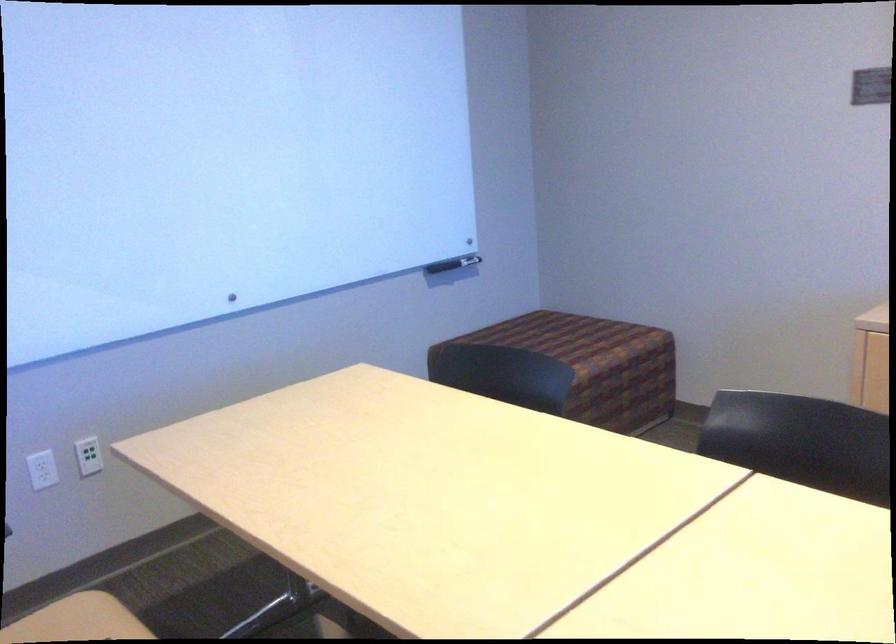
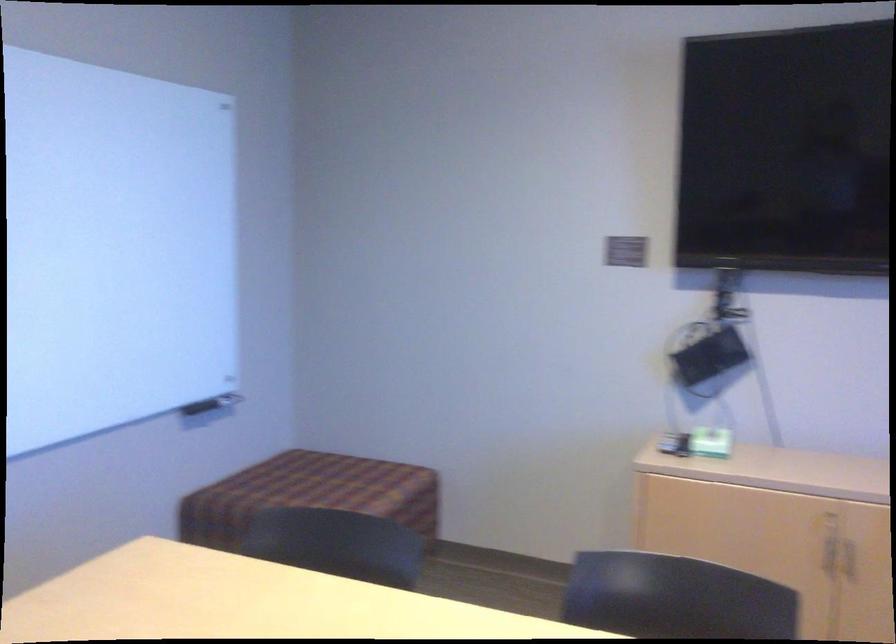
Question: The camera is either moving clockwise (left) or counter-clockwise (right) around the object. The first image is from the beginning of the video and the second image is from the end. Is the camera moving left or right when shooting the video?

Choices:
 (A) Left
 (B) Right

Answer: (A)